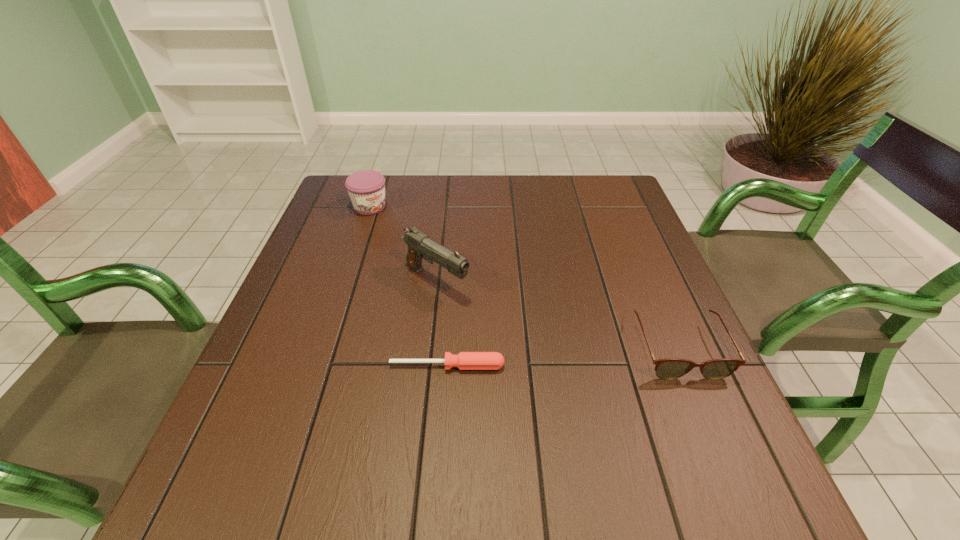
You are a GUI agent. You are given a task and a screenshot of the screen. Output one action in this format:
    pyautogui.click(x=<x>, y=<y>)
    Task: Click on the shortest object
    The height and width of the screenshot is (540, 960).
    Given the screenshot: What is the action you would take?
    pyautogui.click(x=464, y=360)

The height and width of the screenshot is (540, 960). I want to click on the rightmost object, so click(670, 368).

This screenshot has height=540, width=960. I want to click on spectacles, so click(670, 368).

Locate an element on the screen. The height and width of the screenshot is (540, 960). the farthest object is located at coordinates (366, 188).

Where is `jam`? This screenshot has width=960, height=540. jam is located at coordinates (366, 188).

At what (x,y) coordinates should I click in order to perform the action: click on gun. Please return your answer as a coordinate pair (x, y). The height and width of the screenshot is (540, 960). Looking at the image, I should click on (420, 246).

The height and width of the screenshot is (540, 960). Find the location of `the tallest object`. the tallest object is located at coordinates (420, 246).

Locate an element on the screen. free space located 0.130m at the tip of the shortest object is located at coordinates (443, 435).

Image resolution: width=960 pixels, height=540 pixels. In order to click on free location located 0.350m on the front label of the farthest object in this screenshot , I will do `click(457, 276)`.

Identify the location of vacant position located 0.230m on the front label of the farthest object. This screenshot has height=540, width=960. (427, 253).